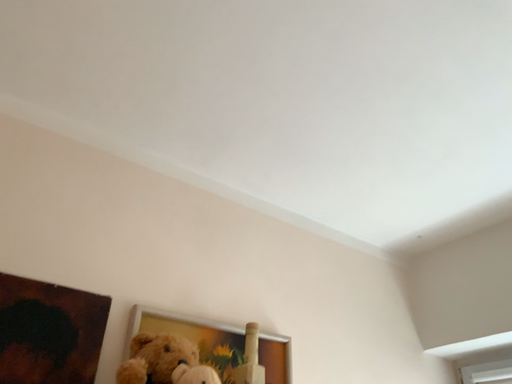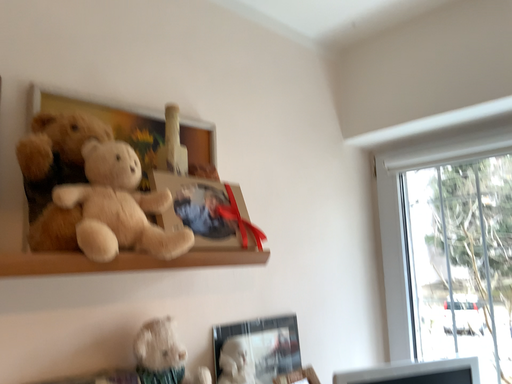
Question: Which way did the camera rotate in the video?

Choices:
 (A) rotated downward
 (B) rotated upward

Answer: (A)